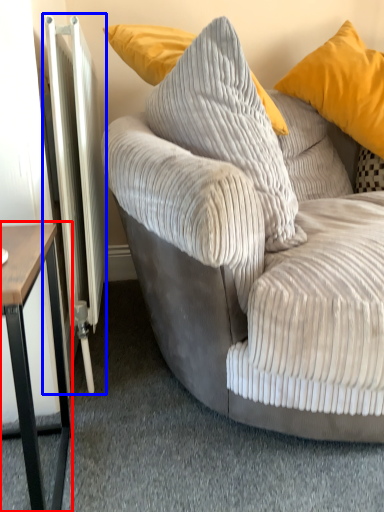
Question: Among these objects, which one is nearest to the camera, table (highlighted by a red box) or radiator (highlighted by a blue box)?

Choices:
 (A) table
 (B) radiator

Answer: (A)